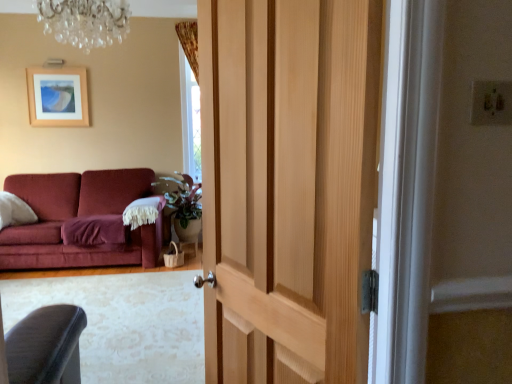
Question: Is wooden picture frame at upper left surrounded by natural wood door at center?

Choices:
 (A) yes
 (B) no

Answer: (B)

Question: Does natural wood door at center have a lesser width compared to wooden picture frame at upper left?

Choices:
 (A) yes
 (B) no

Answer: (B)

Question: Does natural wood door at center have a smaller size compared to wooden picture frame at upper left?

Choices:
 (A) no
 (B) yes

Answer: (A)

Question: Is the depth of natural wood door at center greater than that of wooden picture frame at upper left?

Choices:
 (A) no
 (B) yes

Answer: (A)

Question: Is wooden picture frame at upper left at the back of natural wood door at center?

Choices:
 (A) no
 (B) yes

Answer: (A)

Question: Is natural wood door at center next to wooden picture frame at upper left?

Choices:
 (A) no
 (B) yes

Answer: (A)

Question: From a real-world perspective, is natural wood door at center under crystal glass chandelier at upper center?

Choices:
 (A) yes
 (B) no

Answer: (A)

Question: Considering the relative sizes of natural wood door at center and crystal glass chandelier at upper center in the image provided, is natural wood door at center shorter than crystal glass chandelier at upper center?

Choices:
 (A) yes
 (B) no

Answer: (B)

Question: Is natural wood door at center to the right of crystal glass chandelier at upper center from the viewer's perspective?

Choices:
 (A) no
 (B) yes

Answer: (B)

Question: Is natural wood door at center positioned before crystal glass chandelier at upper center?

Choices:
 (A) no
 (B) yes

Answer: (B)

Question: Would you say natural wood door at center is outside crystal glass chandelier at upper center?

Choices:
 (A) no
 (B) yes

Answer: (B)

Question: Is the depth of natural wood door at center greater than that of crystal glass chandelier at upper center?

Choices:
 (A) yes
 (B) no

Answer: (B)

Question: Is natural wood door at center surrounding fuzzy woolen blanket at left?

Choices:
 (A) no
 (B) yes

Answer: (A)